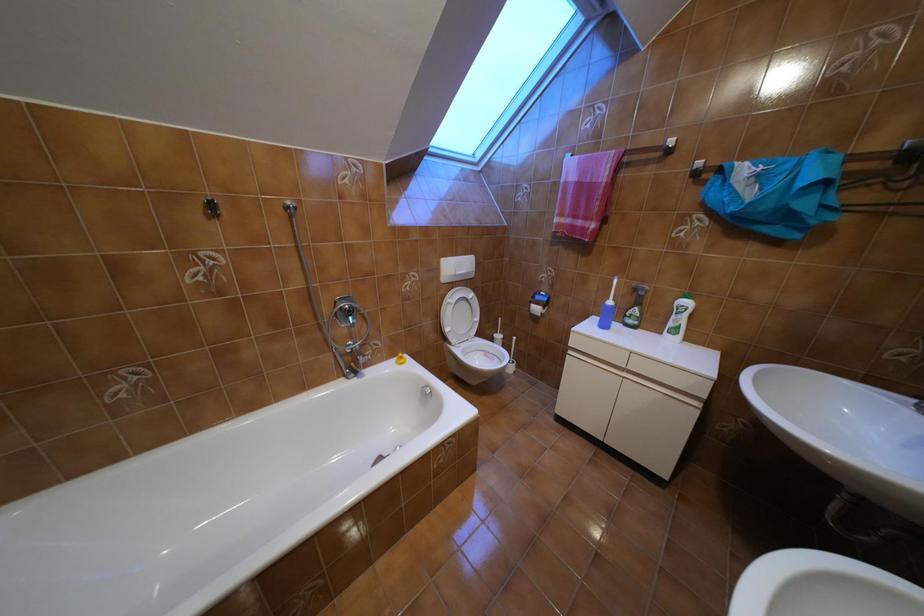
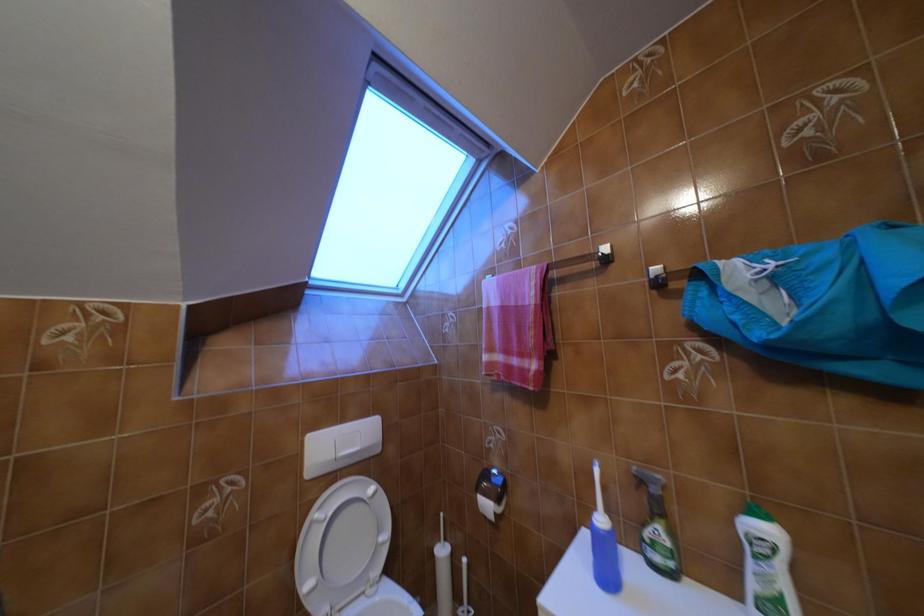
Question: How did the camera likely rotate?

Choices:
 (A) Left
 (B) Right
 (C) Up
 (D) Down

Answer: (C)